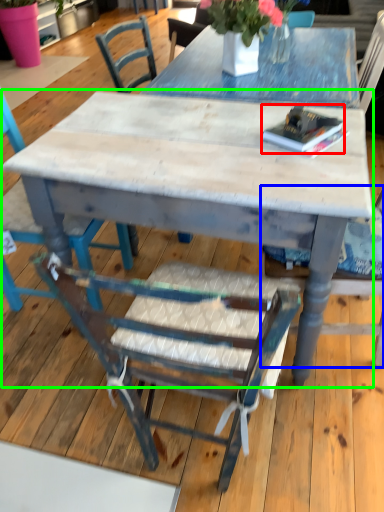
Question: Based on their relative distances, which object is nearer to book (highlighted by a red box)? Choose from chair (highlighted by a blue box) and kitchen & dining room table (highlighted by a green box).

Choices:
 (A) chair
 (B) kitchen & dining room table

Answer: (B)